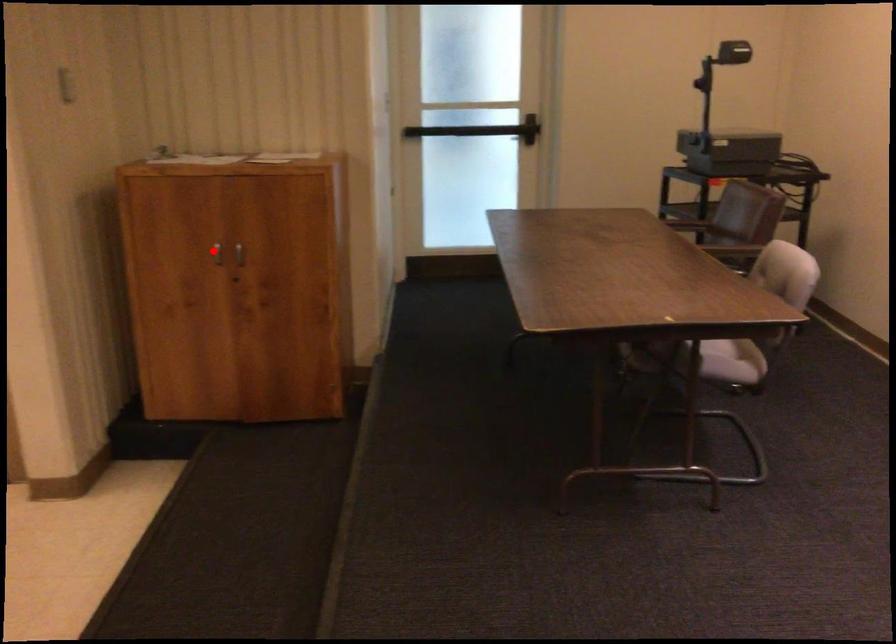
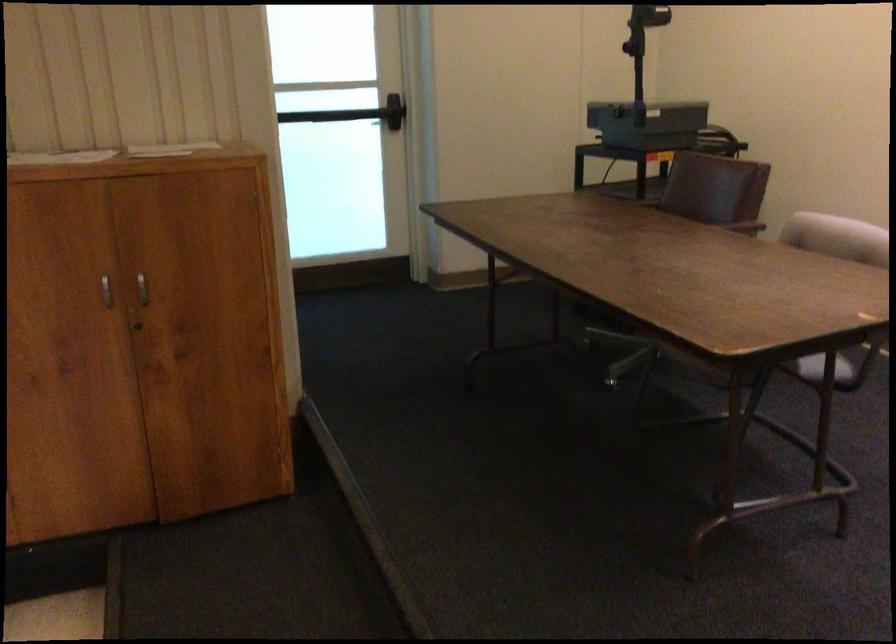
In the second image, find the point that corresponds to the highlighted location in the first image.

(106, 290)